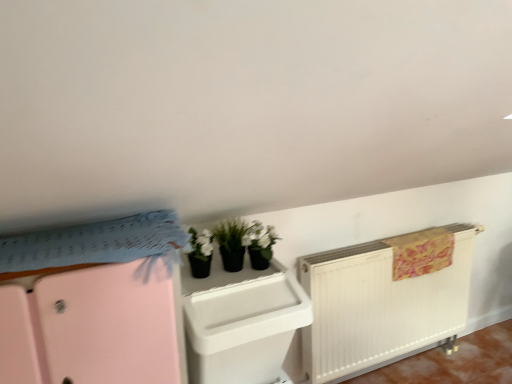
Question: Which direction should I rotate to look at white plastic file cabinet at center, acting as the first file cabinet starting from the right?

Choices:
 (A) left
 (B) right

Answer: (A)

Question: Does pink matte/file cabinet at upper left, arranged as the second file cabinet when viewed from the right, have a lesser width compared to white plastic file cabinet at center, acting as the first file cabinet starting from the right?

Choices:
 (A) no
 (B) yes

Answer: (A)

Question: From the image's perspective, would you say pink matte/file cabinet at upper left, arranged as the second file cabinet when viewed from the right, is positioned over white plastic file cabinet at center, marked as the second file cabinet in a left-to-right arrangement?

Choices:
 (A) no
 (B) yes

Answer: (A)

Question: From a real-world perspective, is pink matte/file cabinet at upper left, arranged as the second file cabinet when viewed from the right, on white plastic file cabinet at center, acting as the first file cabinet starting from the right?

Choices:
 (A) yes
 (B) no

Answer: (A)

Question: Is white plastic file cabinet at center, marked as the second file cabinet in a left-to-right arrangement, at the back of pink matte/file cabinet at upper left, the first file cabinet in the left-to-right sequence?

Choices:
 (A) yes
 (B) no

Answer: (B)

Question: From the image's perspective, is pink matte/file cabinet at upper left, the first file cabinet in the left-to-right sequence, beneath white plastic file cabinet at center, marked as the second file cabinet in a left-to-right arrangement?

Choices:
 (A) no
 (B) yes

Answer: (B)

Question: Considering the relative sizes of pink matte/file cabinet at upper left, arranged as the second file cabinet when viewed from the right, and white plastic file cabinet at center, marked as the second file cabinet in a left-to-right arrangement, in the image provided, is pink matte/file cabinet at upper left, arranged as the second file cabinet when viewed from the right, wider than white plastic file cabinet at center, marked as the second file cabinet in a left-to-right arrangement,?

Choices:
 (A) yes
 (B) no

Answer: (A)

Question: Does white plastic file cabinet at center, acting as the first file cabinet starting from the right, have a lesser height compared to pink matte/file cabinet at upper left, the first file cabinet in the left-to-right sequence?

Choices:
 (A) no
 (B) yes

Answer: (B)

Question: Is white plastic file cabinet at center, acting as the first file cabinet starting from the right, positioned before pink matte/file cabinet at upper left, arranged as the second file cabinet when viewed from the right?

Choices:
 (A) yes
 (B) no

Answer: (B)

Question: Is pink matte/file cabinet at upper left, the first file cabinet in the left-to-right sequence, surrounded by white plastic file cabinet at center, marked as the second file cabinet in a left-to-right arrangement?

Choices:
 (A) yes
 (B) no

Answer: (B)

Question: Does white plastic file cabinet at center, marked as the second file cabinet in a left-to-right arrangement, have a greater height compared to pink matte/file cabinet at upper left, arranged as the second file cabinet when viewed from the right?

Choices:
 (A) yes
 (B) no

Answer: (B)

Question: Is white plastic file cabinet at center, acting as the first file cabinet starting from the right, wider than pink matte/file cabinet at upper left, the first file cabinet in the left-to-right sequence?

Choices:
 (A) yes
 (B) no

Answer: (B)

Question: From a real-world perspective, is white plastic file cabinet at center, acting as the first file cabinet starting from the right, located higher than pink matte/file cabinet at upper left, arranged as the second file cabinet when viewed from the right?

Choices:
 (A) no
 (B) yes

Answer: (A)

Question: From a real-world perspective, relative to white plastic file cabinet at center, marked as the second file cabinet in a left-to-right arrangement, is pink matte/file cabinet at upper left, the first file cabinet in the left-to-right sequence, vertically above or below?

Choices:
 (A) above
 (B) below

Answer: (A)